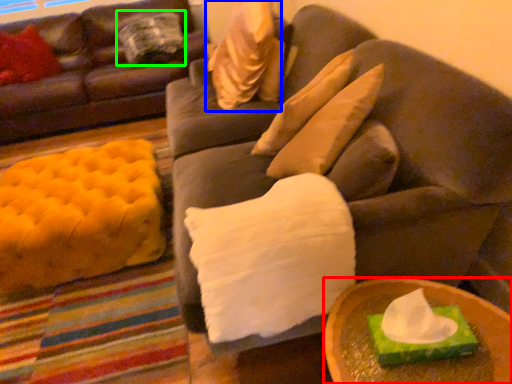
Question: Which object is positioned closest to table (highlighted by a red box)? Select from pillow (highlighted by a blue box) and pillow (highlighted by a green box).

Choices:
 (A) pillow
 (B) pillow

Answer: (A)